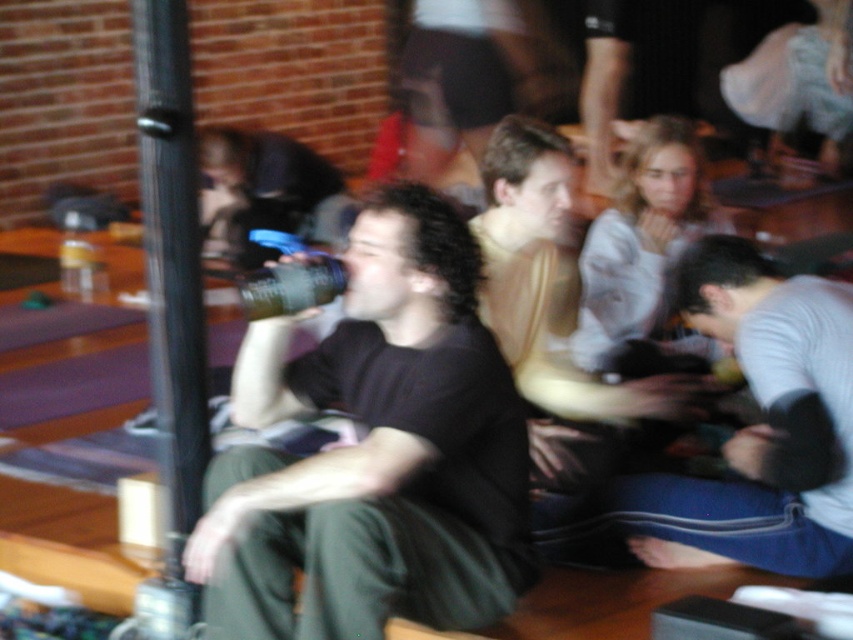
Does gray ribbed sweater at lower right appear on the right side of black plastic pole at left?

Indeed, gray ribbed sweater at lower right is positioned on the right side of black plastic pole at left.

Who is more forward, (x=729, y=330) or (x=202, y=321)?

Point (x=202, y=321)

This screenshot has height=640, width=853. What are the coordinates of `gray ribbed sweater at lower right` in the screenshot? It's located at (776, 404).

Can you confirm if black matte t-shirt at center is positioned to the right of gray ribbed sweater at lower right?

In fact, black matte t-shirt at center is to the left of gray ribbed sweater at lower right.

Is point (260, 545) more distant than point (839, 572)?

That is False.

The image size is (853, 640). I want to click on black matte t-shirt at center, so click(375, 452).

Is black matte t-shirt at center above light brown leather jacket at center?

Actually, black matte t-shirt at center is below light brown leather jacket at center.

This screenshot has height=640, width=853. Identify the location of black matte t-shirt at center. (375, 452).

In order to click on black matte t-shirt at center in this screenshot , I will do `click(375, 452)`.